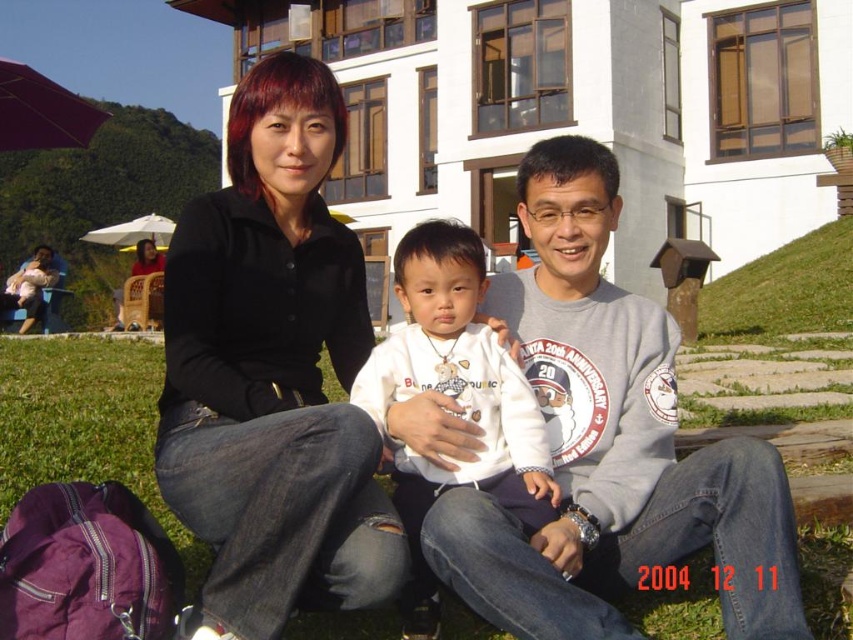
You are a photographer trying to capture the family in the image. You want to focus on the black matte shirt at center. Based on their positions, which direction should you move your camera to ensure the shirt is centered in your shot?

The black matte shirt at center is already at the center of the image, so no adjustment is needed.

You are a clothing designer observing the family in the park. You need to determine which clothing item, the gray cotton sweatshirt at center or the white fleece jacket at center, requires more fabric to produce. Based on the image, which one would you choose?

The gray cotton sweatshirt at center has a larger size compared to the white fleece jacket at center, so it requires more fabric to produce.